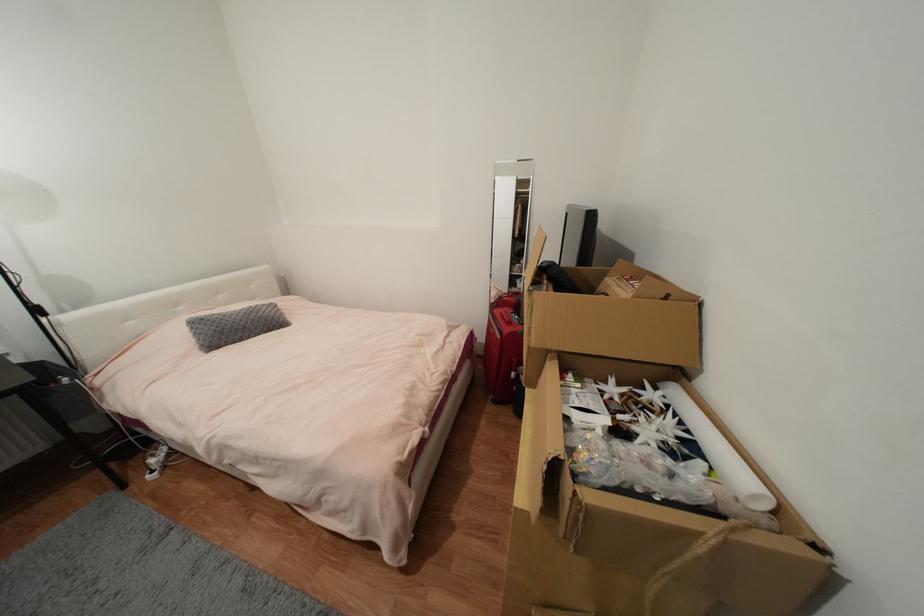
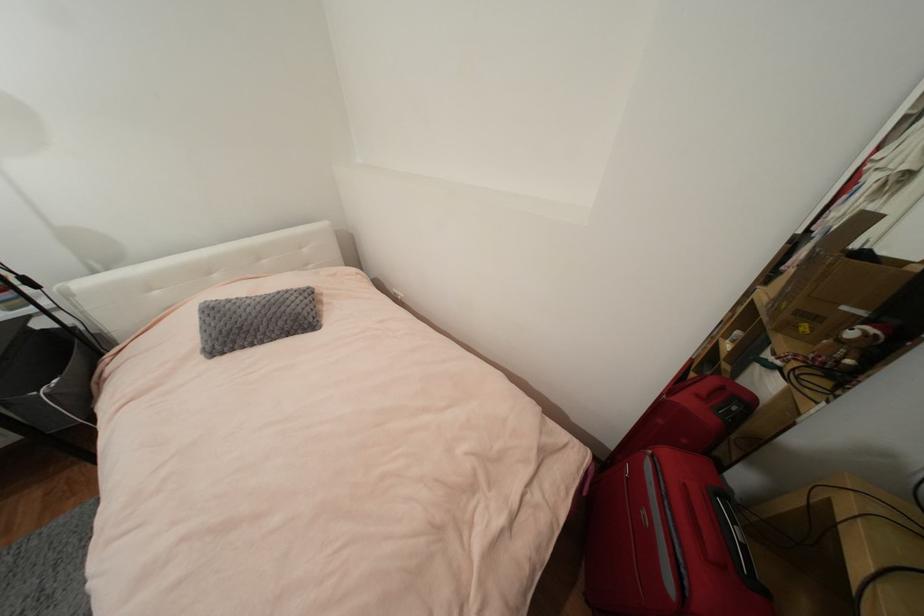
Question: In a continuous first-person perspective shot, in which direction is the camera moving?

Choices:
 (A) Left
 (B) Right
 (C) Forward
 (D) Backward

Answer: (C)